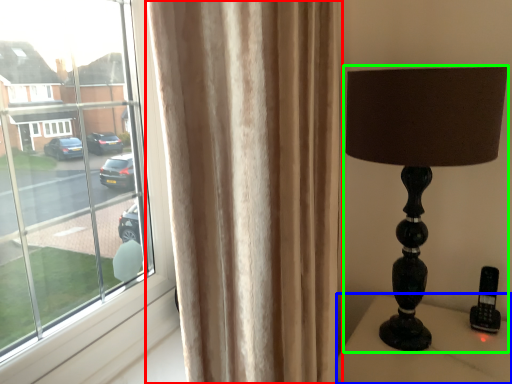
Question: Which object is positioned closest to curtain (highlighted by a red box)? Select from furniture (highlighted by a blue box) and lamp (highlighted by a green box).

Choices:
 (A) furniture
 (B) lamp

Answer: (B)